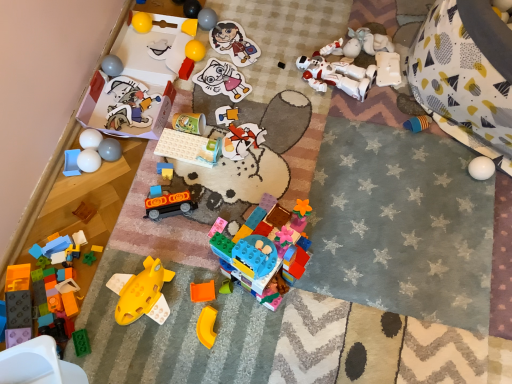
This screenshot has height=384, width=512. Find the location of `free space that is in between yellow matte block at center, which is counted as the eleventh toy, starting from the left, and orange matte toy airplane at center, which is the eighth toy from right to left`. free space that is in between yellow matte block at center, which is counted as the eleventh toy, starting from the left, and orange matte toy airplane at center, which is the eighth toy from right to left is located at coordinates (196, 156).